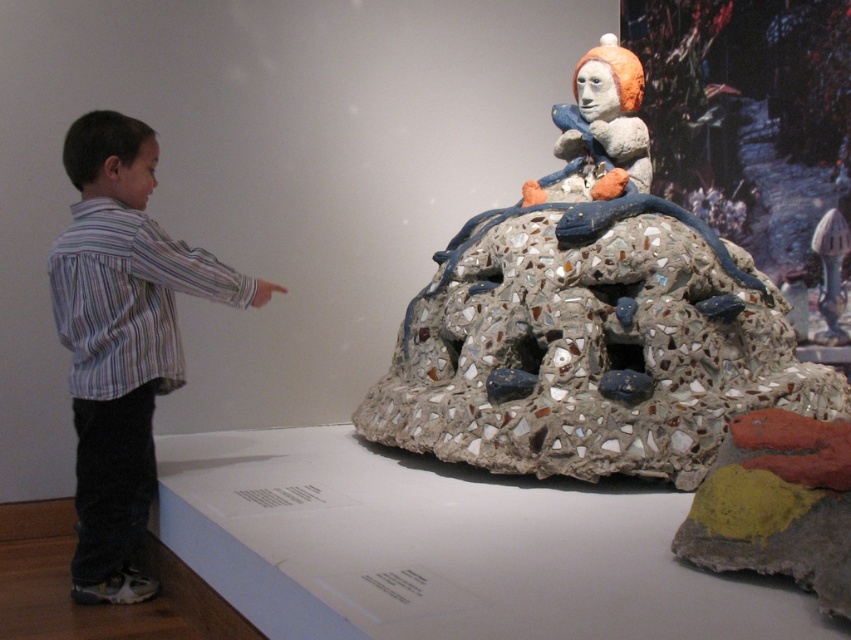
Question: Can you confirm if mosaic stone sculpture at center is positioned to the left of striped shirt at left?

Choices:
 (A) no
 (B) yes

Answer: (A)

Question: Does mosaic stone sculpture at center have a lesser width compared to striped shirt at left?

Choices:
 (A) no
 (B) yes

Answer: (A)

Question: Which point appears farthest from the camera in this image?

Choices:
 (A) (558, 308)
 (B) (136, 161)

Answer: (A)

Question: Is mosaic stone sculpture at center positioned in front of striped shirt at left?

Choices:
 (A) no
 (B) yes

Answer: (A)